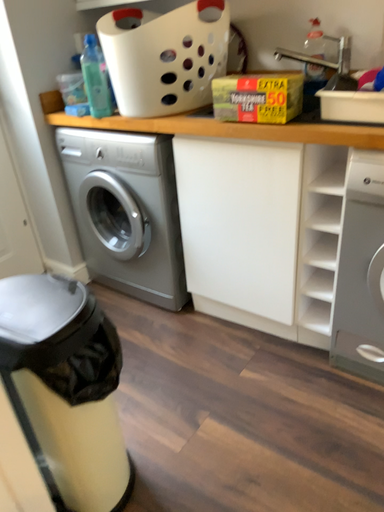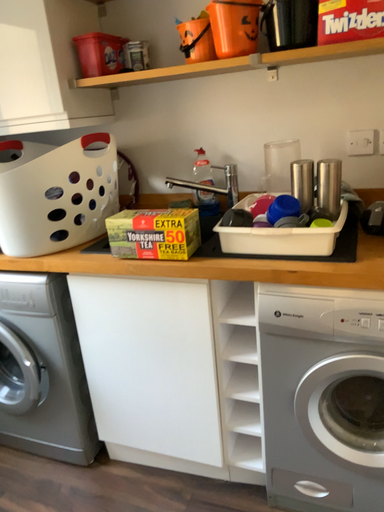
Question: Which way did the camera rotate in the video?

Choices:
 (A) rotated left
 (B) rotated right

Answer: (B)